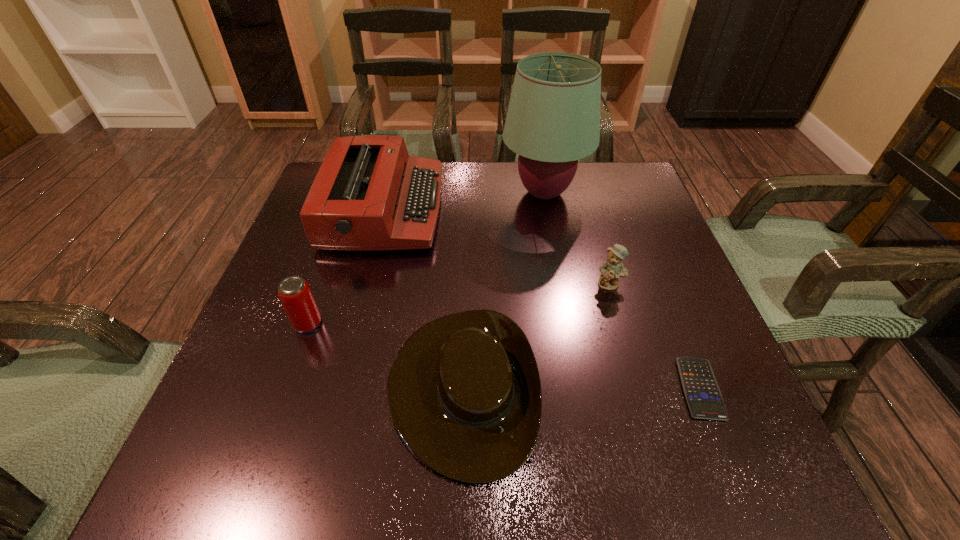
This screenshot has width=960, height=540. In order to click on blank area located on the front-facing side of the fourth nearest object in this screenshot , I will do `click(663, 472)`.

Find the location of a particular element. The width and height of the screenshot is (960, 540). free space located 0.200m on the left of the cowboy hat is located at coordinates (273, 387).

Image resolution: width=960 pixels, height=540 pixels. Identify the location of vacant space located 0.070m on the back of the calculator. (676, 328).

The height and width of the screenshot is (540, 960). In order to click on lampshade at the far edge in this screenshot , I will do `click(553, 120)`.

In order to click on typewriter that is at the far edge in this screenshot , I will do `click(369, 194)`.

Where is `object located in the near edge section of the desktop`? This screenshot has height=540, width=960. object located in the near edge section of the desktop is located at coordinates (464, 393).

Where is `typewriter at the left edge`? The height and width of the screenshot is (540, 960). typewriter at the left edge is located at coordinates (369, 194).

This screenshot has width=960, height=540. I want to click on beer can that is at the left edge, so click(x=294, y=292).

Find the location of a particular element. The height and width of the screenshot is (540, 960). lampshade that is positioned at the right edge is located at coordinates (553, 120).

The width and height of the screenshot is (960, 540). I want to click on teddy bear present at the right edge, so click(613, 269).